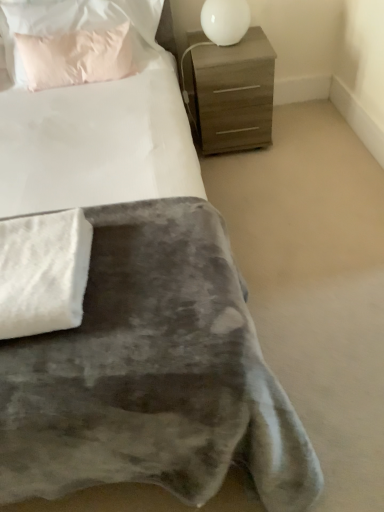
Find the location of a particular element. blank area beneath white glossy table lamp at upper right (from a real-world perspective) is located at coordinates (229, 45).